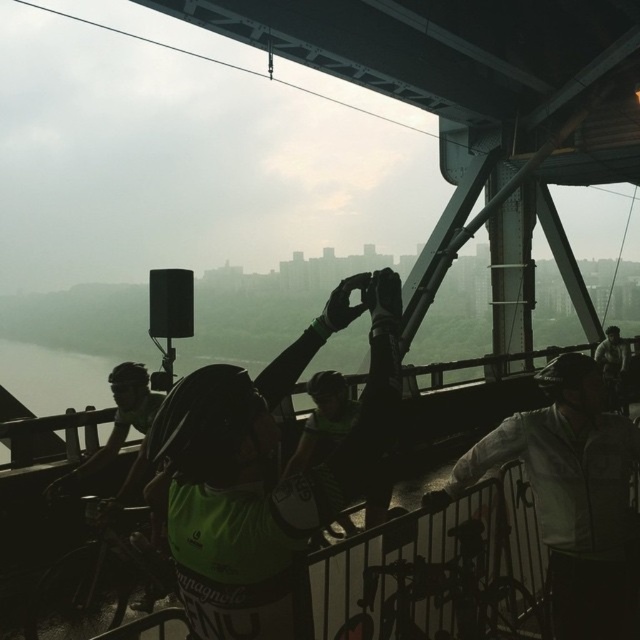
Question: Which point is farther from the camera taking this photo?

Choices:
 (A) (604, 362)
 (B) (544, 481)
 (C) (10, 392)

Answer: (C)

Question: Can you confirm if white matte jacket at center is positioned above green reflective jersey at center?

Choices:
 (A) yes
 (B) no

Answer: (B)

Question: Does white matte jacket at center have a lesser width compared to transparent water at center?

Choices:
 (A) yes
 (B) no

Answer: (A)

Question: Among these objects, which one is nearest to the camera?

Choices:
 (A) green reflective jersey at center
 (B) transparent water at center
 (C) white matte jacket at center

Answer: (C)

Question: In this image, where is white matte jacket at center located relative to green reflective jersey at center?

Choices:
 (A) above
 (B) below

Answer: (B)

Question: Which object is positioned closest to the transparent water at center?

Choices:
 (A) white matte jacket at center
 (B) green reflective jersey at center

Answer: (B)